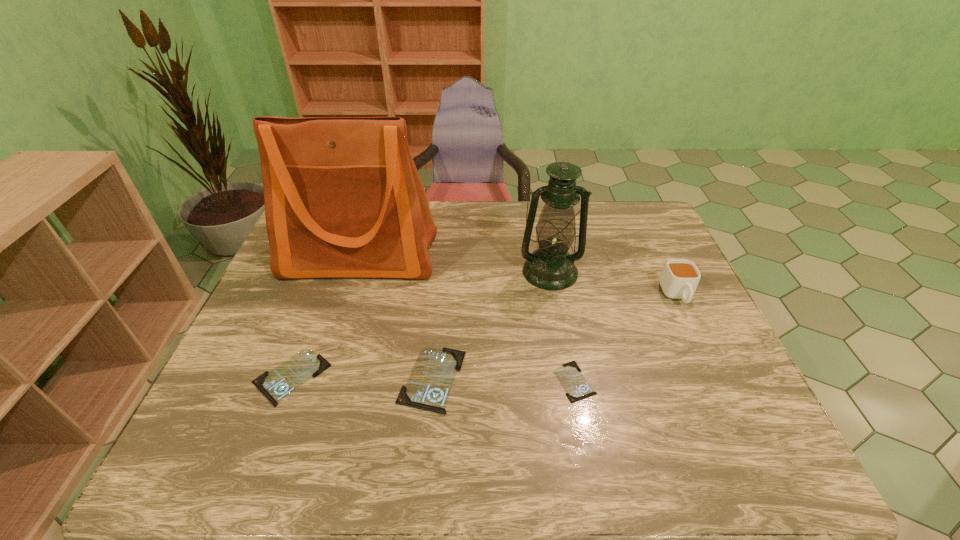
The height and width of the screenshot is (540, 960). What are the coordinates of `free space located 0.290m on the left of the second identity card from right to left` in the screenshot? It's located at (276, 379).

Image resolution: width=960 pixels, height=540 pixels. I want to click on free space located on the right of the shortest object, so click(x=684, y=381).

Find the location of `free space located 0.070m on the front pocket of the shopping bag`. free space located 0.070m on the front pocket of the shopping bag is located at coordinates (346, 303).

I want to click on free space located 0.270m on the back of the oil lamp, so click(539, 207).

This screenshot has height=540, width=960. Identify the location of blank area located on the side with the handle of the third tallest object. (699, 341).

Locate an element on the screen. This screenshot has height=540, width=960. object situated at the far edge is located at coordinates (343, 199).

This screenshot has width=960, height=540. What are the coordinates of `identity card at the left edge` in the screenshot? It's located at tap(275, 385).

Locate an element on the screen. The image size is (960, 540). shopping bag that is at the left edge is located at coordinates (343, 199).

Identify the location of object at the right edge. This screenshot has height=540, width=960. (679, 280).

The image size is (960, 540). Find the location of `object present at the far left corner`. object present at the far left corner is located at coordinates (343, 199).